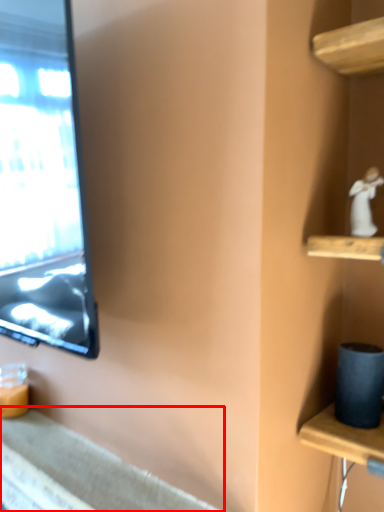
Question: In this image, where is counter top (annotated by the red box) located relative to miniature?

Choices:
 (A) left
 (B) right

Answer: (A)